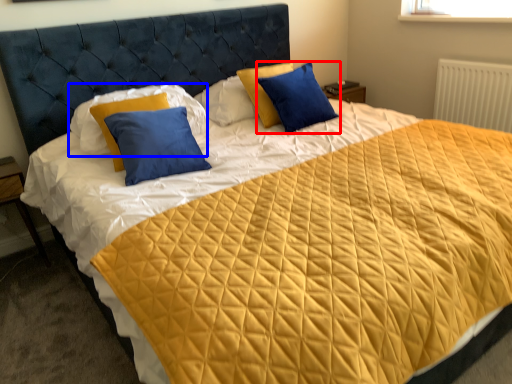
Question: Which point is closer to the camera, pillow (highlighted by a red box) or pillow (highlighted by a blue box)?

Choices:
 (A) pillow
 (B) pillow

Answer: (B)